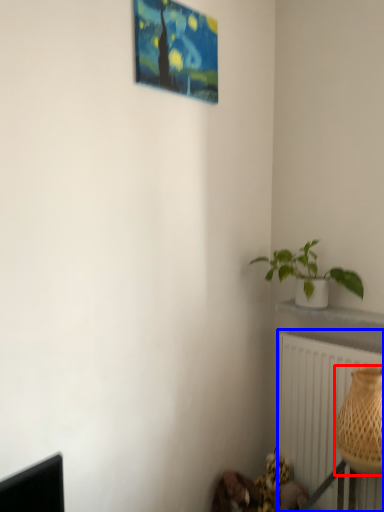
Question: Which point is further to the camera, basket (highlighted by a red box) or radiator (highlighted by a blue box)?

Choices:
 (A) basket
 (B) radiator

Answer: (B)